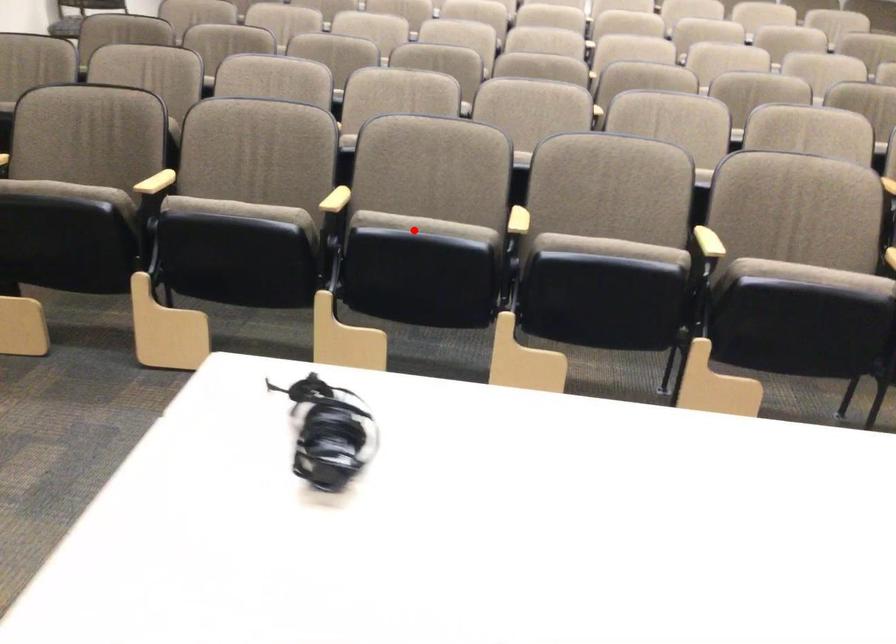
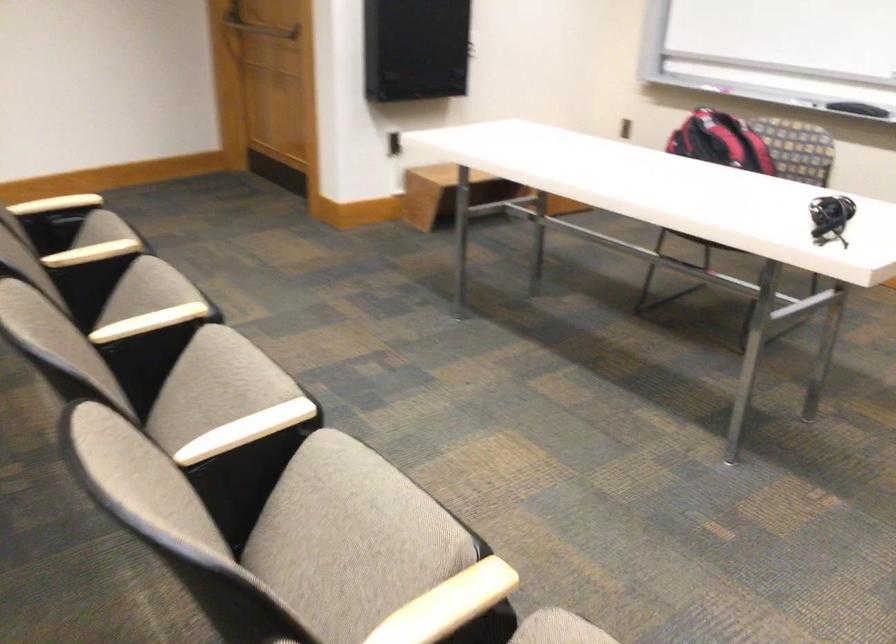
Question: A red point is marked in image1. In image2, is the corresponding 3D point closer to the camera or farther? Reply with the corresponding letter.

Choices:
 (A) The corresponding 3D point is closer.
 (B) The corresponding 3D point is farther.

Answer: (A)